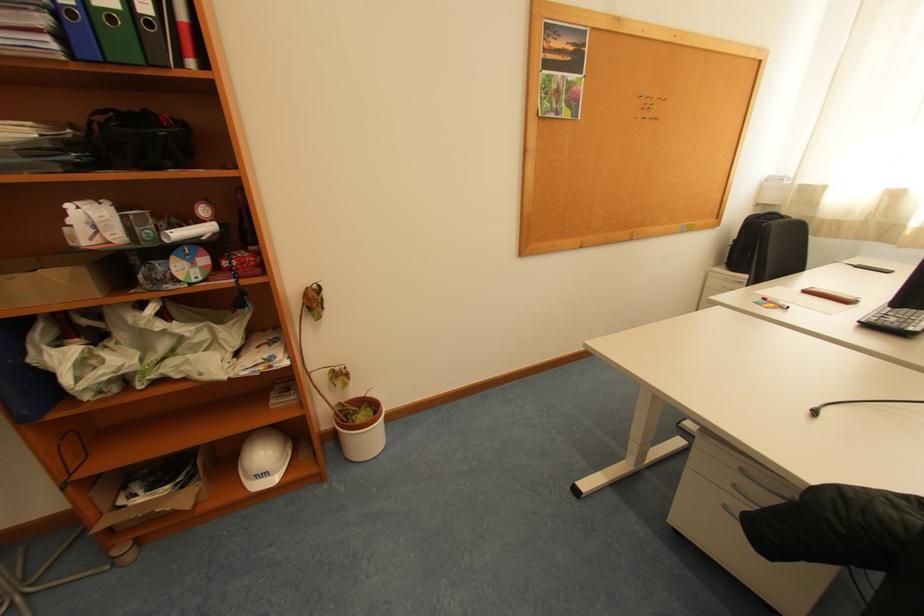
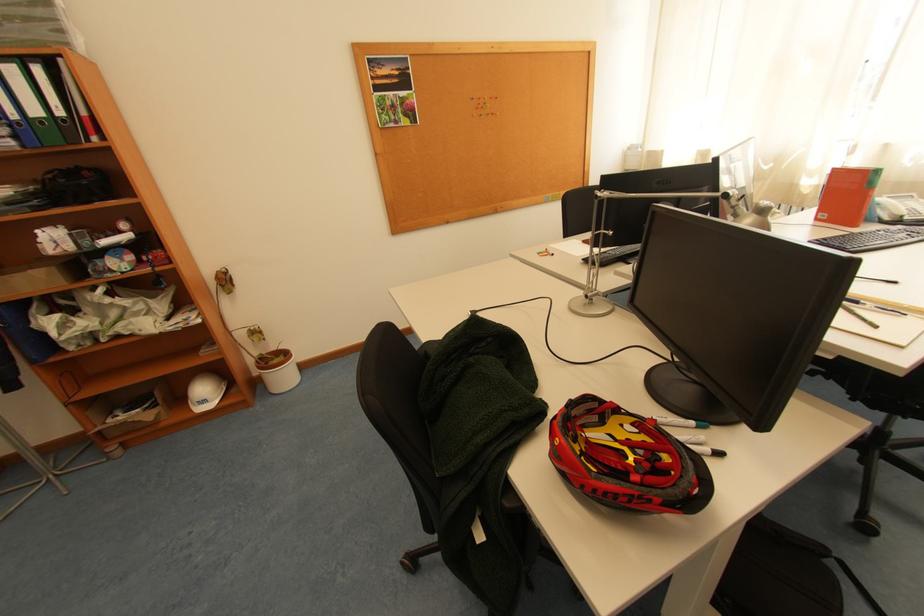
Where in the second image is the point corresponding to pixel 643 120 from the first image?

(481, 118)